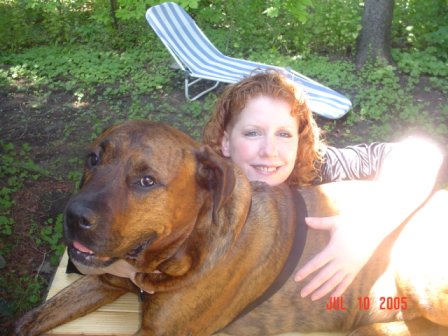
At what (x,y) coordinates should I click in order to perform the action: click on table. Please return your answer as a coordinate pair (x, y). This screenshot has width=448, height=336. Looking at the image, I should click on (97, 318).